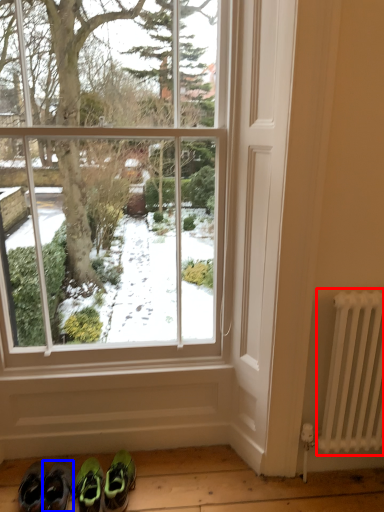
Question: Which point is further to the camera, radiator (highlighted by a red box) or footwear (highlighted by a blue box)?

Choices:
 (A) radiator
 (B) footwear

Answer: (B)